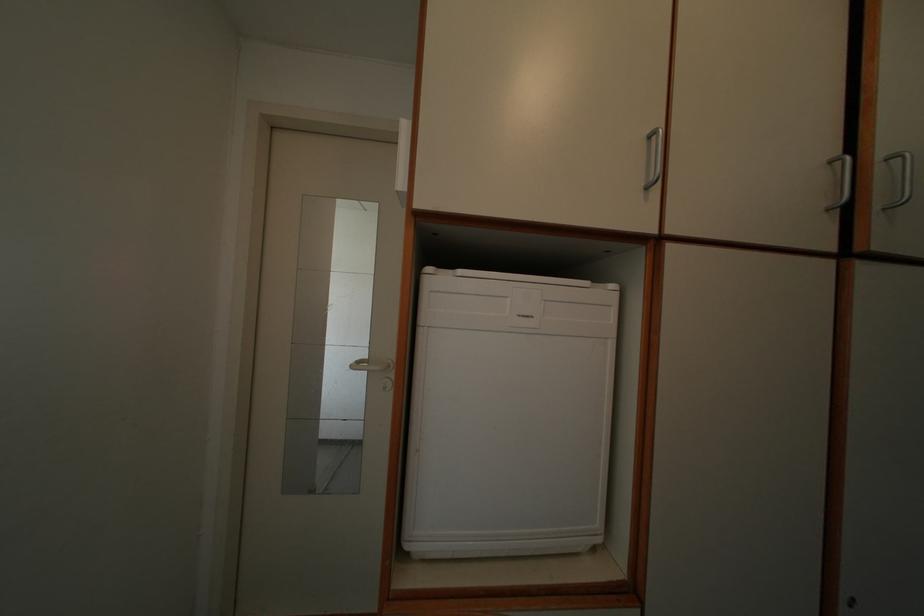
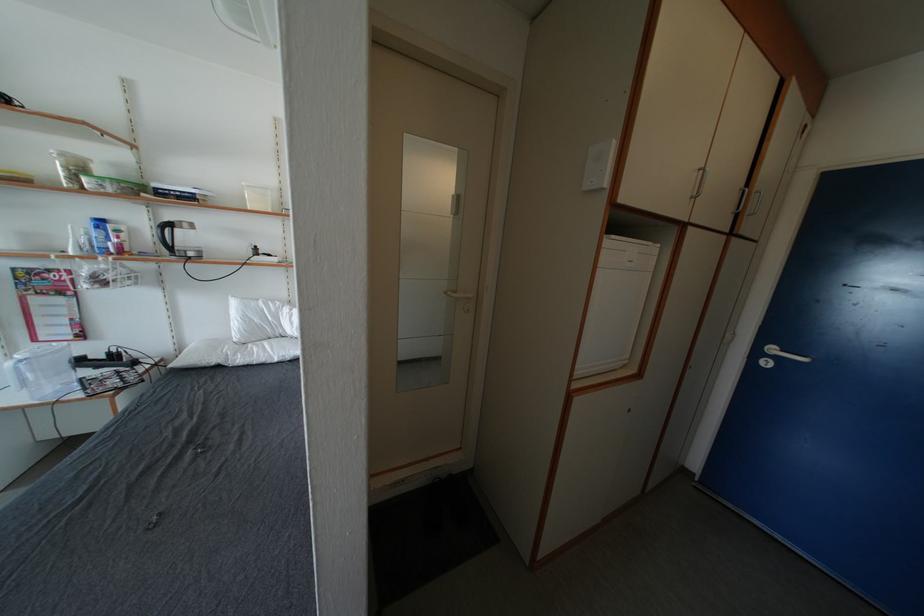
Question: Which direction would the cameraman need to move to produce the second image? Reply with the corresponding letter.

Choices:
 (A) Left
 (B) Right
 (C) Forward
 (D) Backward

Answer: (A)